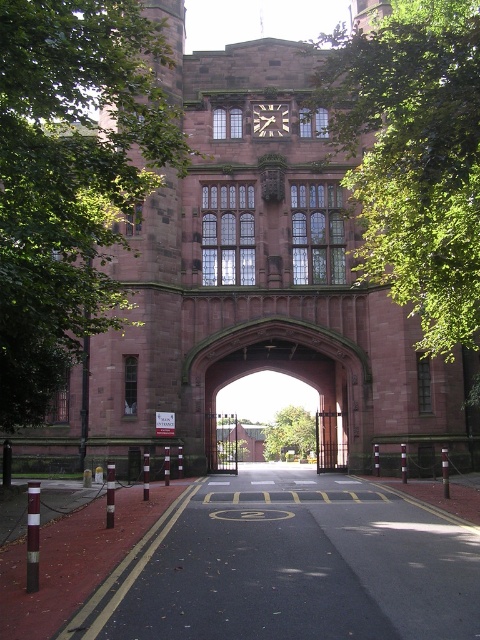
You are a maintenance worker needing to reach both the green leafy tree at upper left and the wooden clock at upper center. Given that your ladder can only extend to 100 feet, can you safely reach both objects with a single ladder without moving it?

The green leafy tree at upper left is 113.41 feet from the wooden clock at upper center. Since the ladder can only extend to 100 feet, it is not long enough to reach both objects simultaneously without moving it.

You are a visitor approaching the building through the open gates. You notice a green leafy tree at upper left and a wooden clock at upper center in your view. Which object appears larger in the scene?

The green leafy tree at upper left appears larger than the wooden clock at upper center in the scene.